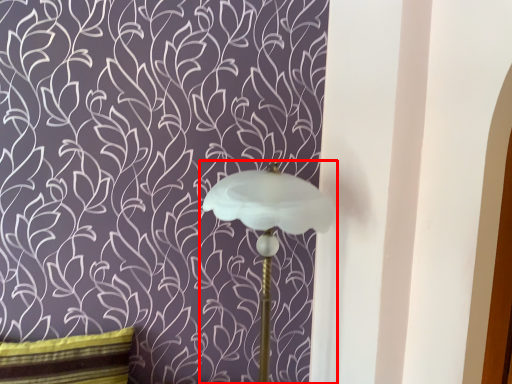
Question: Considering the relative positions of lamp (annotated by the red box) and pillow in the image provided, where is lamp (annotated by the red box) located with respect to the staircase?

Choices:
 (A) left
 (B) right

Answer: (B)